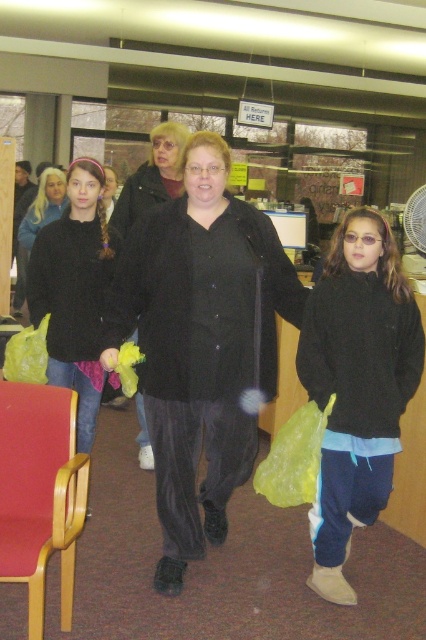
Based on the photo, can you confirm if black velvet coat at center is shorter than wooden armchair at lower left?

No.

Measure the distance between black velvet coat at center and camera.

They are 7.58 feet apart.

What are the coordinates of `black velvet coat at center` in the screenshot? It's located at (201, 342).

Which is in front, point (203, 360) or point (166, 196)?

Point (203, 360)

Which of these two, black velvet coat at center or matte black coat at center, stands shorter?

matte black coat at center

Between point (166, 321) and point (132, 177), which one is positioned behind?

Point (132, 177)

Where is `black velvet coat at center`? Image resolution: width=426 pixels, height=640 pixels. black velvet coat at center is located at coordinates (201, 342).

The width and height of the screenshot is (426, 640). What do you see at coordinates (201, 342) in the screenshot?
I see `black velvet coat at center` at bounding box center [201, 342].

Which is in front, point (233, 209) or point (348, 422)?

Positioned in front is point (348, 422).

Locate an element on the screen. This screenshot has width=426, height=640. black velvet coat at center is located at coordinates (201, 342).